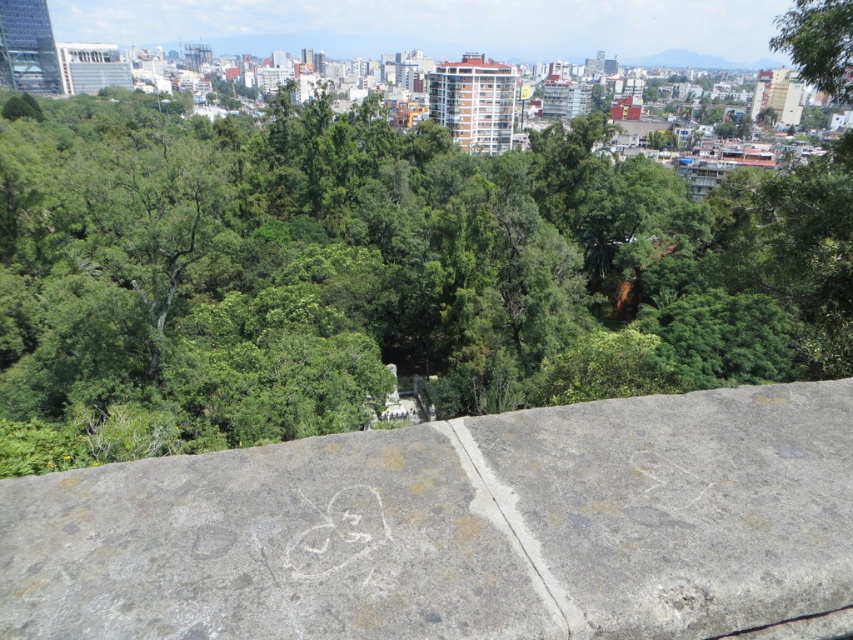
You are a city planner analyzing this area. You see the green leafy tree at center and the gray concrete wall at center. Which object is positioned higher in the scene?

The green leafy tree at center is located above the gray concrete wall at center, so it is positioned higher in the scene.

You are standing on a stone wall overlooking a city. You see a green leafy tree at center. If you want to throw a small pebble to hit the tree, would you need to throw it further than 50 feet?

The green leafy tree at center is 46.23 feet away from viewer, so no, you don not need to throw it further than 50 feet.